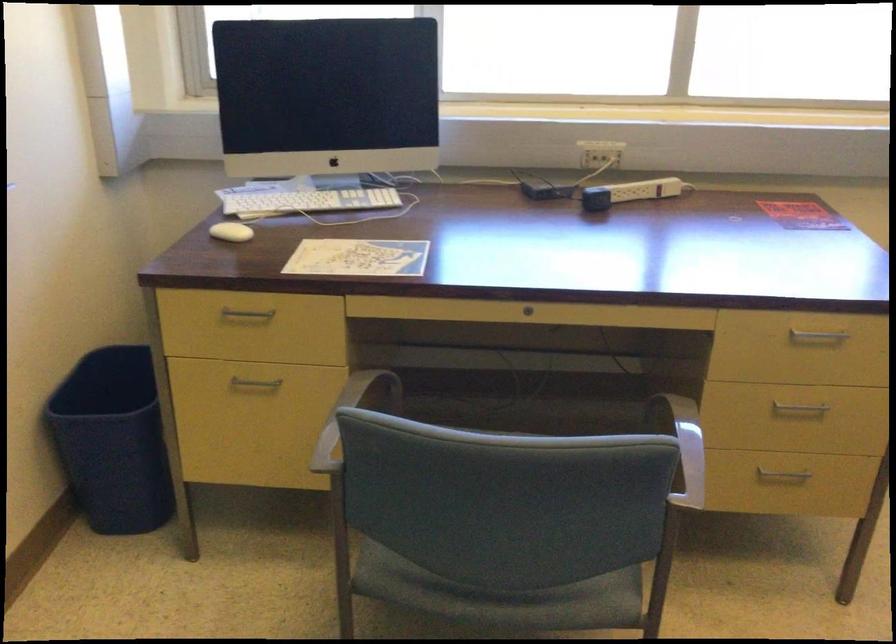
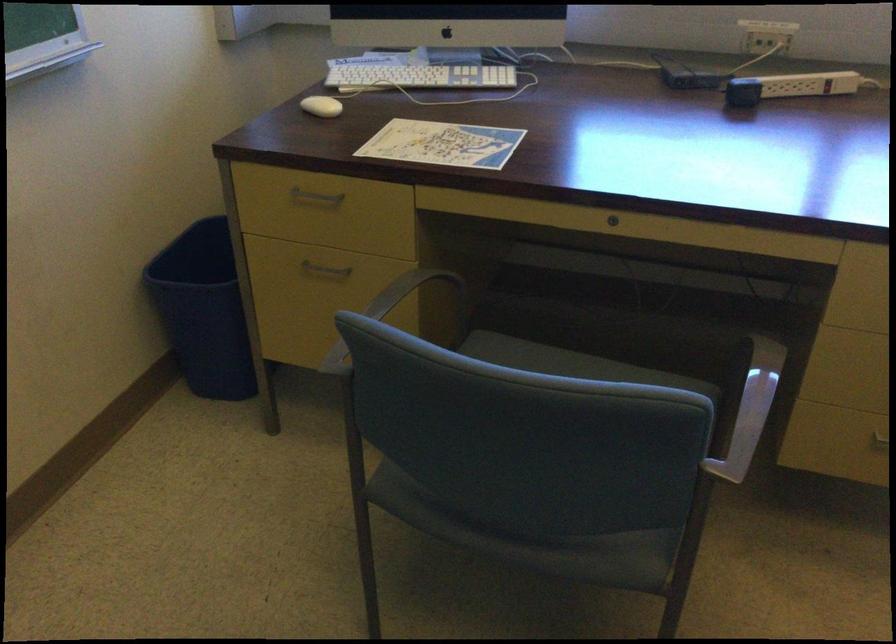
Find the pixel in the second image that matches [256,383] in the first image.

(324, 269)